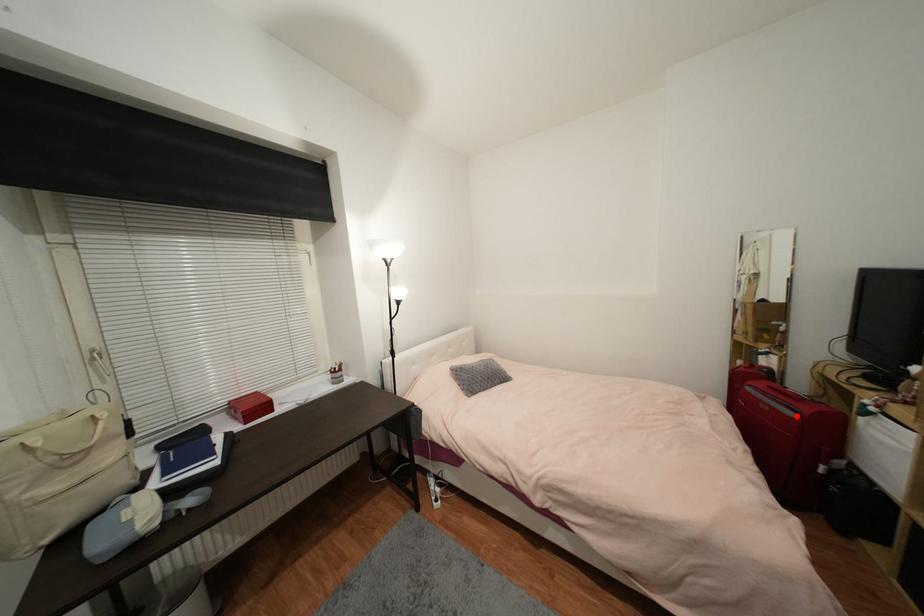
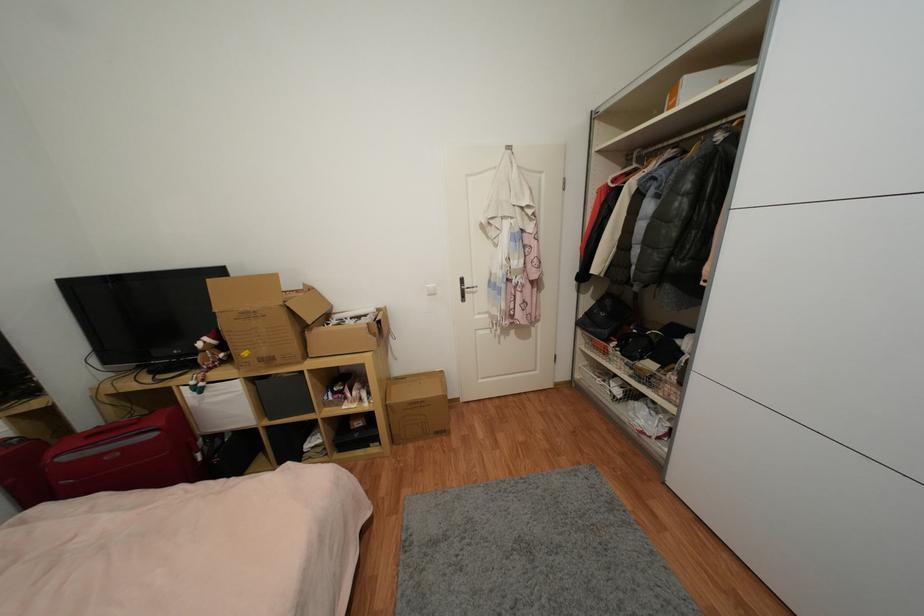
Locate, in the second image, the point that corresponds to the highlighted location in the first image.

(157, 436)